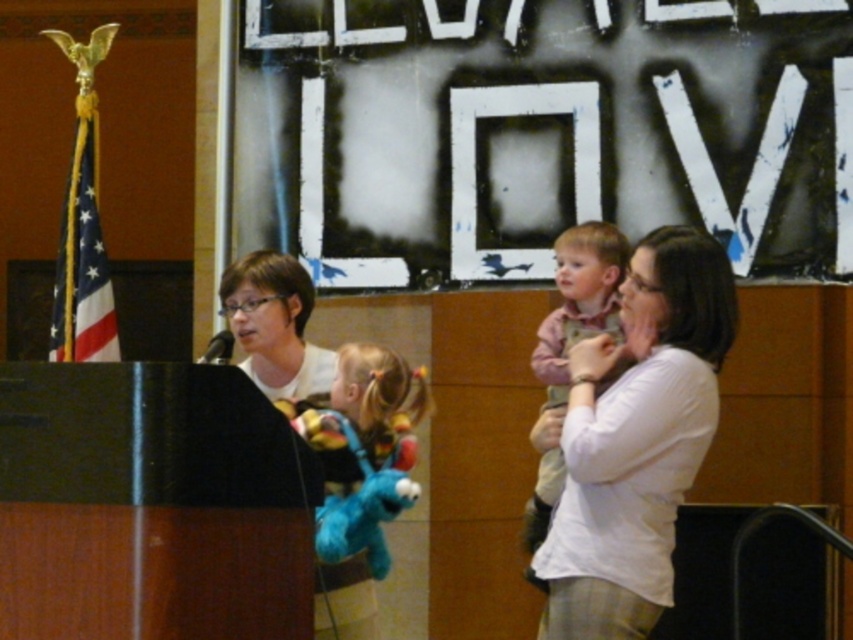
In the scene shown: You are organizing a charity event and need to decide which volunteer should stand closer to the podium. The volunteer wearing the pink cotton shirt at center and the volunteer wearing the matte white shirt at center are both available. Based on their clothing, which volunteer should be positioned closer to the podium?

The volunteer wearing the pink cotton shirt at center should be positioned closer to the podium because they are taller than the volunteer in the matte white shirt at center, ensuring better visibility for the audience.

You are a photographer standing in the scene and want to take a photo of both the white cotton shirt at center and the matte white shirt at center. Which one will appear larger in the photo?

The white cotton shirt at center will appear larger in the photo because it is closer to the viewer than the matte white shirt at center.

You are organizing a photo shoot and need to place a decorative item between the white cotton shirt at center and the pink cotton shirt at center. Which shirt should the item be closer to if you want it to be equidistant from both shirts based on their widths?

The decorative item should be placed closer to the pink cotton shirt at center because the white cotton shirt at center might be wider, requiring the item to offset the width difference to maintain equal distance.